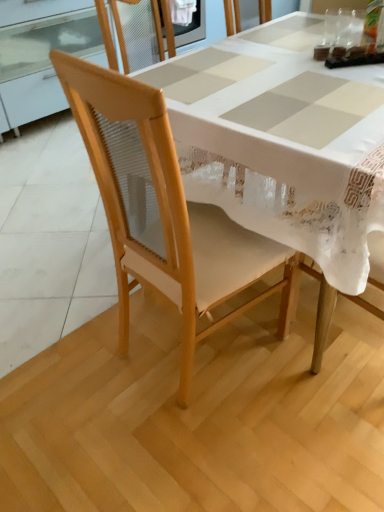
The image size is (384, 512). What do you see at coordinates (330, 27) in the screenshot? I see `transparent plastic cup at upper right, placed as the first tableware when sorted from left to right` at bounding box center [330, 27].

The width and height of the screenshot is (384, 512). What do you see at coordinates (344, 28) in the screenshot?
I see `transparent glass at upper center, placed as the first tableware when sorted from right to left` at bounding box center [344, 28].

Find the location of a particular element. The image size is (384, 512). white fabric table at center is located at coordinates (286, 150).

Is white fabric table at center to the right of transparent glass at upper center, placed as the first tableware when sorted from right to left, from the viewer's perspective?

No, white fabric table at center is not to the right of transparent glass at upper center, placed as the first tableware when sorted from right to left.

Does point (383, 113) come farther from viewer compared to point (349, 21)?

No, it is not.

From the picture: Is white fabric table at center positioned with its back to transparent glass at upper center, which ranks as the second tableware in left-to-right order?

No, white fabric table at center's orientation is not away from transparent glass at upper center, which ranks as the second tableware in left-to-right order.

How distant is white fabric table at center from transparent glass at upper center, which ranks as the second tableware in left-to-right order?

white fabric table at center is 60.63 centimeters from transparent glass at upper center, which ranks as the second tableware in left-to-right order.

Could you tell me if transparent glass at upper center, placed as the first tableware when sorted from right to left, is turned towards natural wood chair at center?

No.

Between transparent glass at upper center, placed as the first tableware when sorted from right to left, and natural wood chair at center, which one has smaller width?

transparent glass at upper center, placed as the first tableware when sorted from right to left.

Is transparent glass at upper center, which ranks as the second tableware in left-to-right order, bigger or smaller than natural wood chair at center?

transparent glass at upper center, which ranks as the second tableware in left-to-right order, is smaller than natural wood chair at center.

From the image's perspective, is natural wood chair at center positioned above or below transparent glass at upper center, placed as the first tableware when sorted from right to left?

Based on their image positions, natural wood chair at center is located beneath transparent glass at upper center, placed as the first tableware when sorted from right to left.

Is natural wood chair at center aimed at transparent glass at upper center, which ranks as the second tableware in left-to-right order?

Yes, natural wood chair at center faces towards transparent glass at upper center, which ranks as the second tableware in left-to-right order.

Does natural wood chair at center have a lesser width compared to transparent glass at upper center, which ranks as the second tableware in left-to-right order?

No, natural wood chair at center is not thinner than transparent glass at upper center, which ranks as the second tableware in left-to-right order.

Considering the sizes of objects transparent glass at upper center, placed as the first tableware when sorted from right to left, and white fabric table at center in the image provided, who is smaller, transparent glass at upper center, placed as the first tableware when sorted from right to left, or white fabric table at center?

Smaller between the two is transparent glass at upper center, placed as the first tableware when sorted from right to left.

Considering the relative positions of transparent glass at upper center, which ranks as the second tableware in left-to-right order, and white fabric table at center in the image provided, is transparent glass at upper center, which ranks as the second tableware in left-to-right order, to the left or to the right of white fabric table at center?

transparent glass at upper center, which ranks as the second tableware in left-to-right order, is positioned on white fabric table at center's right side.

Find the location of a particular element. table below the transparent glass at upper center, placed as the first tableware when sorted from right to left (from a real-world perspective) is located at coordinates (286, 150).

From a real-world perspective, which object rests below the other?

In real-world perspective, white fabric table at center is lower.

Between white fabric table at center and natural wood chair at center, which one has smaller size?

With smaller size is natural wood chair at center.

Is natural wood chair at center at the back of white fabric table at center?

No, natural wood chair at center is not at the back of white fabric table at center.

How much distance is there between transparent glass at upper center, which ranks as the second tableware in left-to-right order, and transparent plastic cup at upper right, placed as the first tableware when sorted from left to right?

transparent glass at upper center, which ranks as the second tableware in left-to-right order, is 1.51 inches away from transparent plastic cup at upper right, placed as the first tableware when sorted from left to right.

From a real-world perspective, is transparent glass at upper center, which ranks as the second tableware in left-to-right order, above or below transparent plastic cup at upper right, placed as the first tableware when sorted from left to right?

Clearly, from a real-world perspective, transparent glass at upper center, which ranks as the second tableware in left-to-right order, is above transparent plastic cup at upper right, placed as the first tableware when sorted from left to right.

Which is behind, point (343, 47) or point (331, 15)?

Point (331, 15)

From the image's perspective, is transparent glass at upper center, which ranks as the second tableware in left-to-right order, on top of transparent plastic cup at upper right, the 2th tableware from the right?

Yes, from the image's perspective, transparent glass at upper center, which ranks as the second tableware in left-to-right order, is above transparent plastic cup at upper right, the 2th tableware from the right.

Is natural wood chair at center at the left side of white fabric table at center?

Indeed, natural wood chair at center is positioned on the left side of white fabric table at center.

From a real-world perspective, is natural wood chair at center physically located above or below white fabric table at center?

Clearly, from a real-world perspective, natural wood chair at center is above white fabric table at center.

From the image's perspective, is natural wood chair at center located beneath white fabric table at center?

Indeed, from the image's perspective, natural wood chair at center is shown beneath white fabric table at center.

From the image's perspective, which tableware is the 2nd one above the white fabric table at center? Please provide its 2D coordinates.

[(344, 28)]

The image size is (384, 512). I want to click on the 2nd tableware behind the natural wood chair at center, starting your count from the anchor, so click(344, 28).

Looking at this image, based on their spatial positions, is transparent plastic cup at upper right, the 2th tableware from the right, or natural wood chair at center further from white fabric table at center?

transparent plastic cup at upper right, the 2th tableware from the right.

Considering their positions, is white fabric table at center positioned further to natural wood chair at center than transparent glass at upper center, placed as the first tableware when sorted from right to left?

Among the two, transparent glass at upper center, placed as the first tableware when sorted from right to left, is located further to natural wood chair at center.

When comparing their distances from natural wood chair at center, does transparent plastic cup at upper right, placed as the first tableware when sorted from left to right, or white fabric table at center seem further?

transparent plastic cup at upper right, placed as the first tableware when sorted from left to right, lies further to natural wood chair at center than the other object.

Considering their positions, is natural wood chair at center positioned closer to transparent glass at upper center, which ranks as the second tableware in left-to-right order, than white fabric table at center?

white fabric table at center is closer to transparent glass at upper center, which ranks as the second tableware in left-to-right order.

Which object lies further to the anchor point transparent plastic cup at upper right, the 2th tableware from the right, natural wood chair at center or white fabric table at center?

natural wood chair at center is further to transparent plastic cup at upper right, the 2th tableware from the right.

When comparing their distances from transparent glass at upper center, which ranks as the second tableware in left-to-right order, does transparent plastic cup at upper right, the 2th tableware from the right, or white fabric table at center seem further?

white fabric table at center is positioned further to the anchor transparent glass at upper center, which ranks as the second tableware in left-to-right order.

From the picture: Considering their positions, is transparent glass at upper center, which ranks as the second tableware in left-to-right order, positioned closer to white fabric table at center than transparent plastic cup at upper right, the 2th tableware from the right?

Among the two, transparent glass at upper center, which ranks as the second tableware in left-to-right order, is located nearer to white fabric table at center.

Based on their spatial positions, is transparent plastic cup at upper right, the 2th tableware from the right, or transparent glass at upper center, placed as the first tableware when sorted from right to left, further from natural wood chair at center?

Based on the image, transparent glass at upper center, placed as the first tableware when sorted from right to left, appears to be further to natural wood chair at center.

At what (x,y) coordinates should I click in order to perform the action: click on table positioned between natural wood chair at center and transparent plastic cup at upper right, placed as the first tableware when sorted from left to right, from near to far. Please return your answer as a coordinate pair (x, y). Image resolution: width=384 pixels, height=512 pixels. Looking at the image, I should click on (286, 150).

Where is `tableware located between white fabric table at center and transparent glass at upper center, which ranks as the second tableware in left-to-right order, in the depth direction`? The image size is (384, 512). tableware located between white fabric table at center and transparent glass at upper center, which ranks as the second tableware in left-to-right order, in the depth direction is located at coordinates tap(330, 27).

Find the location of `tableware between natural wood chair at center and transparent glass at upper center, placed as the first tableware when sorted from right to left, from front to back`. tableware between natural wood chair at center and transparent glass at upper center, placed as the first tableware when sorted from right to left, from front to back is located at coordinates (330, 27).

Locate an element on the screen. This screenshot has width=384, height=512. table located between natural wood chair at center and transparent glass at upper center, placed as the first tableware when sorted from right to left, in the depth direction is located at coordinates (286, 150).